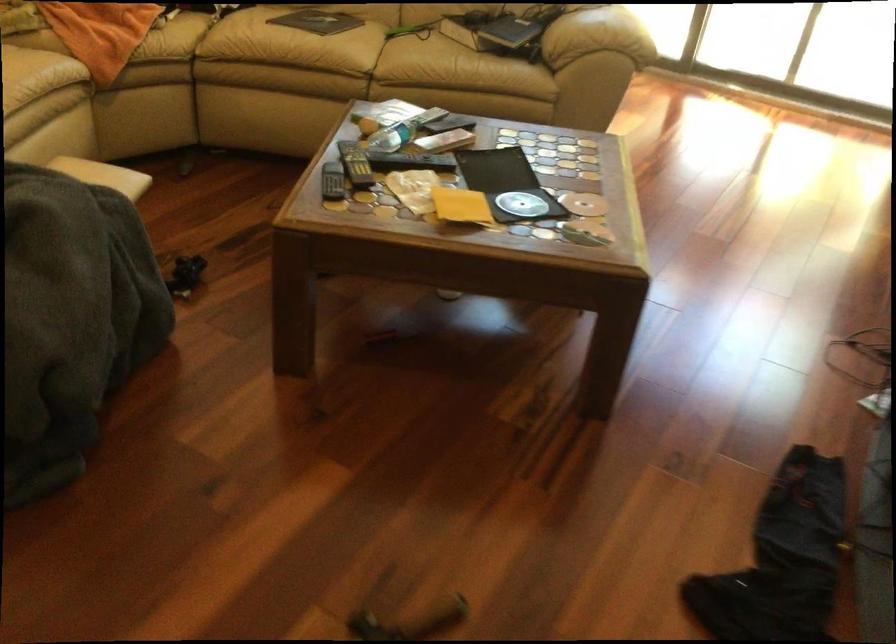
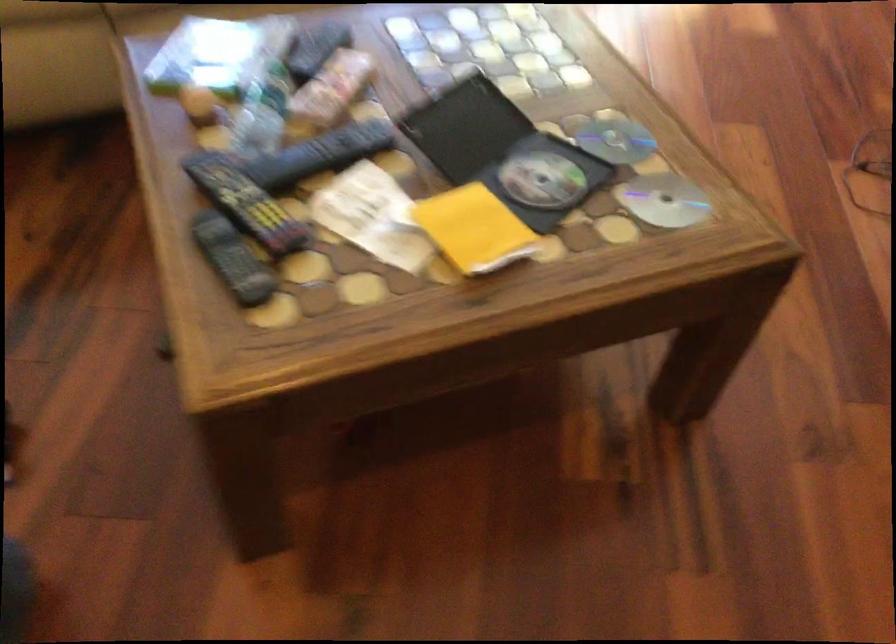
The point at (x=328, y=178) is marked in the first image. Where is the corresponding point in the second image?

(233, 259)